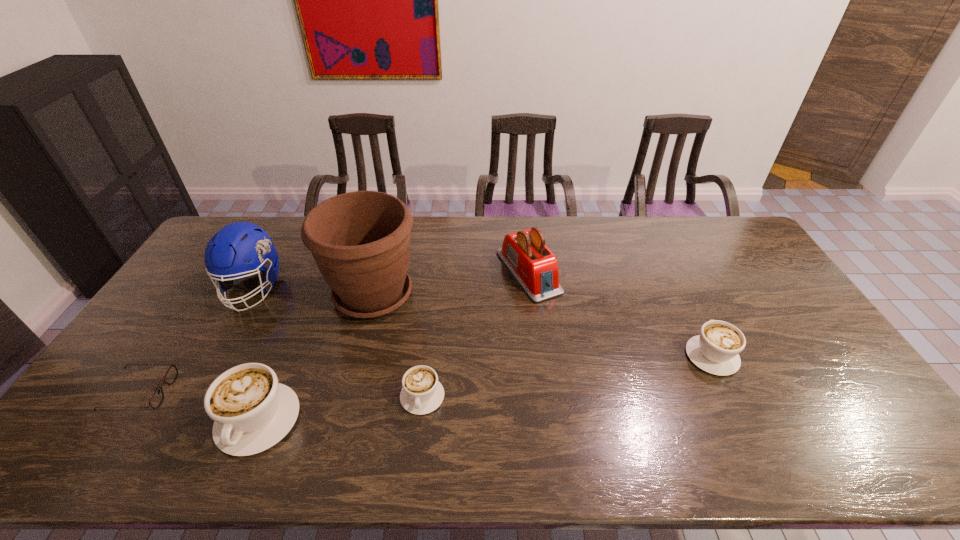
The width and height of the screenshot is (960, 540). What are the coordinates of `vacant area between the football helmet and the second shortest object` in the screenshot? It's located at (337, 342).

Identify the location of free space between the tallest object and the second cappuccino from left to right. (397, 346).

This screenshot has width=960, height=540. In order to click on vacant point located between the leftmost cappuccino and the second tallest object in this screenshot , I will do `click(255, 354)`.

Image resolution: width=960 pixels, height=540 pixels. Identify the location of free space between the leftmost cappuccino and the sixth object from left to right. (393, 346).

Image resolution: width=960 pixels, height=540 pixels. In order to click on free spot between the shortest cappuccino and the rightmost object in this screenshot , I will do `click(567, 376)`.

At what (x,y) coordinates should I click in order to perform the action: click on free space between the football helmet and the sixth tallest object. Please return your answer as a coordinate pair (x, y). The height and width of the screenshot is (540, 960). Looking at the image, I should click on (337, 342).

Where is `free spot between the tallest object and the sunglasses`? free spot between the tallest object and the sunglasses is located at coordinates (257, 343).

Point out which object is positioned as the third nearest to the rightmost object. Please provide its 2D coordinates. Your answer should be formatted as a tuple, i.e. [(x, y)], where the tuple contains the x and y coordinates of a point satisfying the conditions above.

[(360, 241)]

Identify which object is the third closest to the leftmost cappuccino. Please provide its 2D coordinates. Your answer should be formatted as a tuple, i.e. [(x, y)], where the tuple contains the x and y coordinates of a point satisfying the conditions above.

[(422, 393)]

Identify which cappuccino is the nearest to the rightmost cappuccino. Please provide its 2D coordinates. Your answer should be formatted as a tuple, i.e. [(x, y)], where the tuple contains the x and y coordinates of a point satisfying the conditions above.

[(422, 393)]